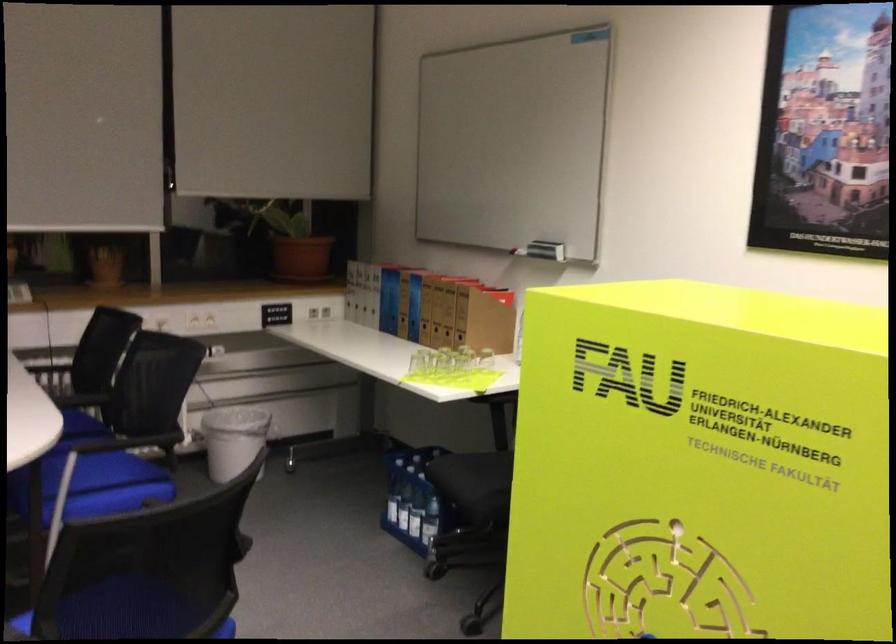
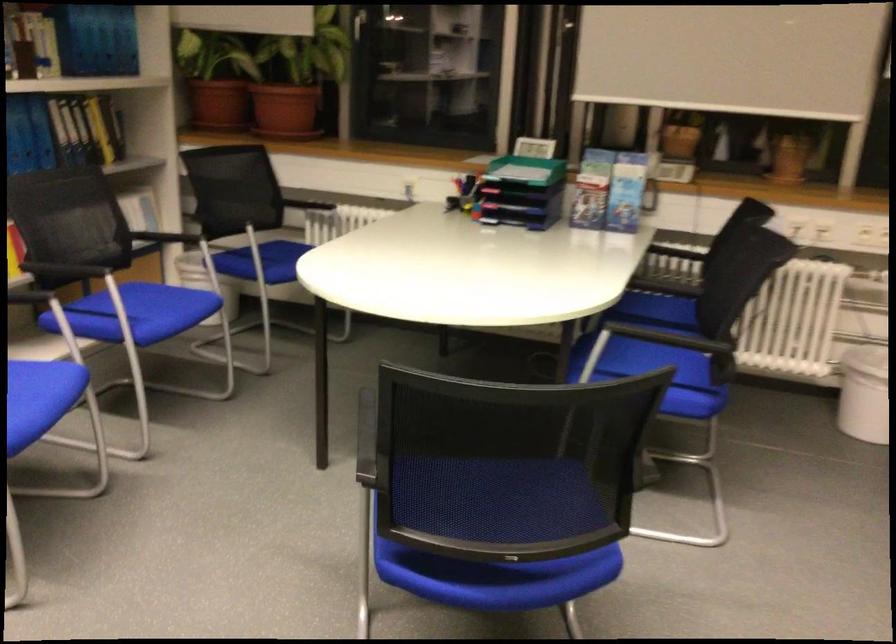
Question: The images are taken continuously from a first-person perspective. In which direction is your viewpoint rotating?

Choices:
 (A) Left
 (B) Right
 (C) Up
 (D) Down

Answer: (A)